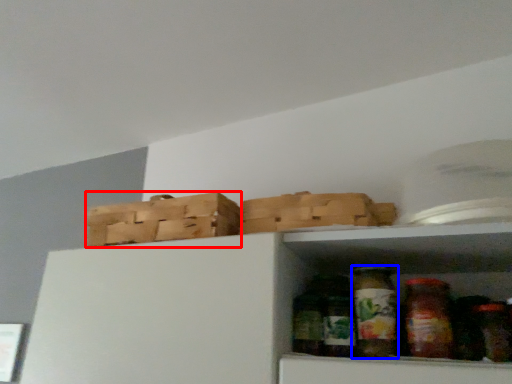
Question: Which point is closer to the camera, basket (highlighted by a red box) or glass jar (highlighted by a blue box)?

Choices:
 (A) basket
 (B) glass jar

Answer: (B)